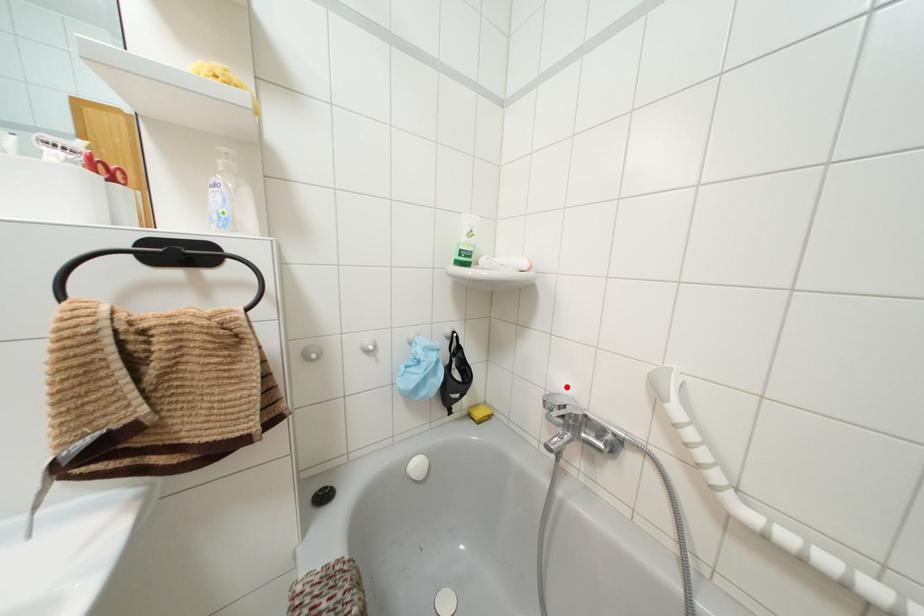
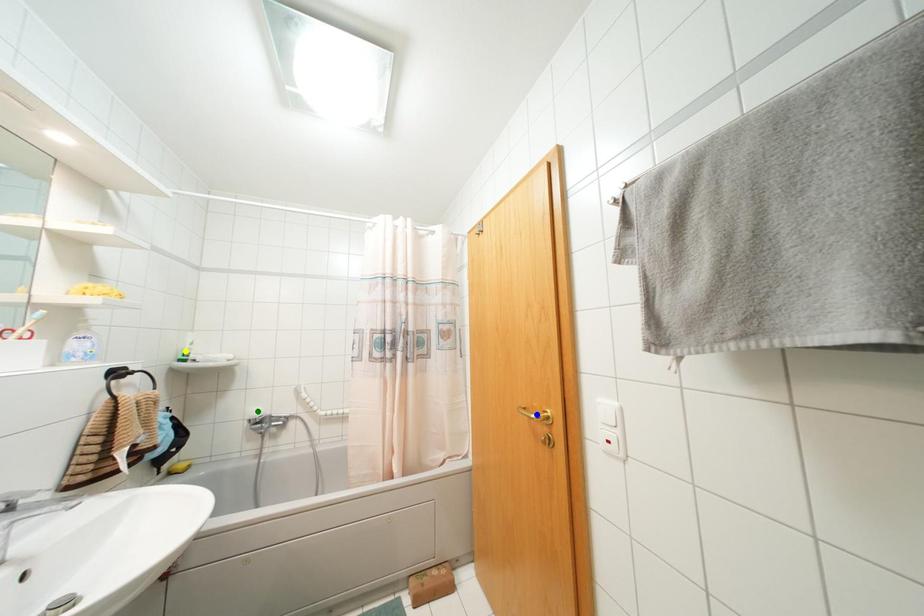
Question: I am providing you with two images of the same scene from different viewpoints. A red point is marked on the first image. You are given multiple points on the second image. Which spot in image 2 lines up with the point in image 1?

Choices:
 (A) yellow point
 (B) green point
 (C) blue point

Answer: (B)